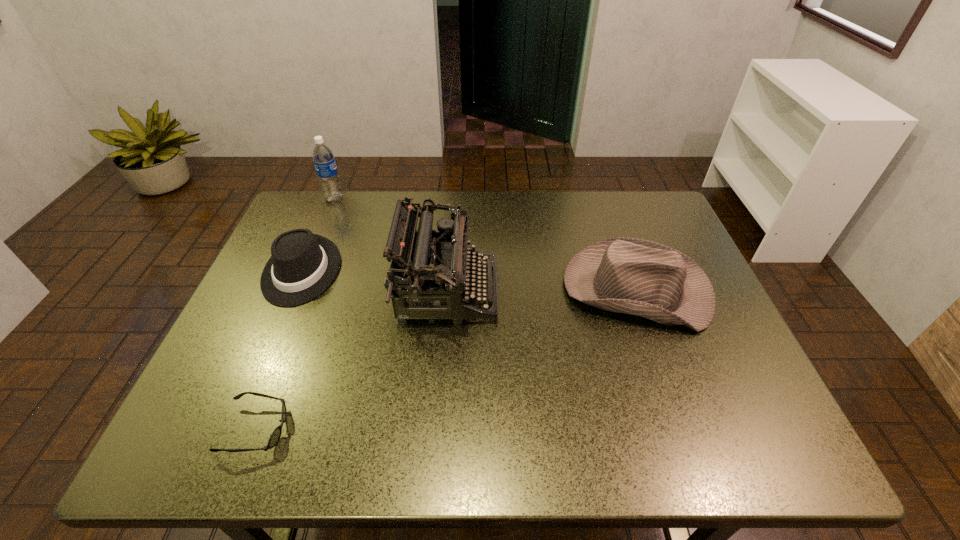
I want to click on object situated at the near left corner, so click(x=275, y=436).

Identify the location of vacant space at the far edge. Image resolution: width=960 pixels, height=540 pixels. (605, 207).

Find the location of a particular element. Image resolution: width=960 pixels, height=540 pixels. vacant space at the near edge of the desktop is located at coordinates (547, 432).

Locate an element on the screen. This screenshot has width=960, height=540. vacant space at the left edge of the desktop is located at coordinates (274, 317).

At what (x,y) coordinates should I click in order to perform the action: click on free space at the far left corner of the desktop. Please return your answer as a coordinate pair (x, y). Looking at the image, I should click on (325, 201).

Locate an element on the screen. vacant space at the near left corner of the desktop is located at coordinates (239, 441).

In the image, there is a desktop. At what (x,y) coordinates should I click in order to perform the action: click on vacant space at the far right corner. Please return your answer as a coordinate pair (x, y). Looking at the image, I should click on (647, 195).

Where is `vacant area between the water bottle and the sunglasses`? The width and height of the screenshot is (960, 540). vacant area between the water bottle and the sunglasses is located at coordinates (296, 314).

Find the location of a particular element. free space between the second shortest object and the typewriter is located at coordinates (374, 281).

Image resolution: width=960 pixels, height=540 pixels. In order to click on free space between the typewriter and the second shortest object in this screenshot , I will do `click(374, 281)`.